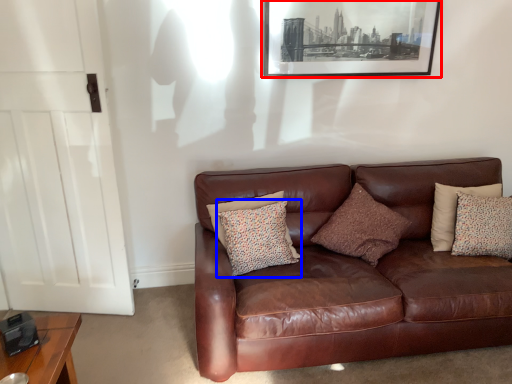
Question: Which of the following is the farthest to the observer, picture frame (highlighted by a red box) or pillow (highlighted by a blue box)?

Choices:
 (A) picture frame
 (B) pillow

Answer: (A)